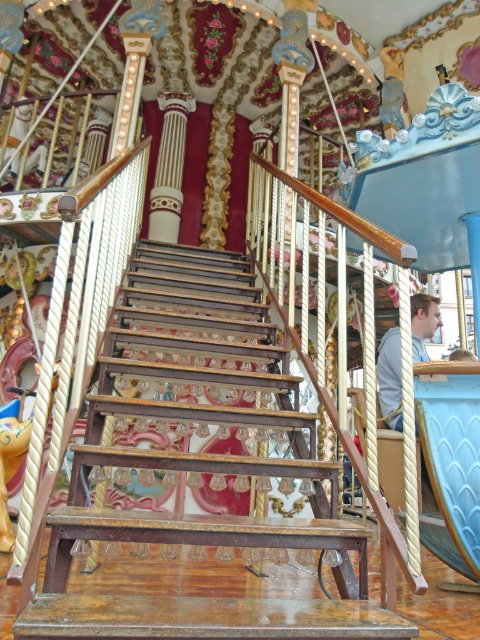
You are standing at the bottom of the wooden stairs at center and want to reach the person wearing the light blue shirt at center. Which direction should you go to move towards them?

The wooden stairs at center is located below the light blue shirt at center, so you should go upwards to move towards them.

You are standing in the vintage carousel and want to take a photo of both the wooden stairs at center and the light blue shirt at center. Which object should you focus on first to ensure both are in clear view?

You should focus on the wooden stairs at center first since it is closer to the viewer than the light blue shirt at center, ensuring both are in clear view.

You are standing at the base of the wooden stairs at center and see a person wearing a light blue shirt at center. If you want to reach the upper level, which object should you climb?

You should climb the wooden stairs at center to reach the upper level since it is a staircase designed for climbing, while the light blue shirt at center is an article of clothing and cannot be climbed.